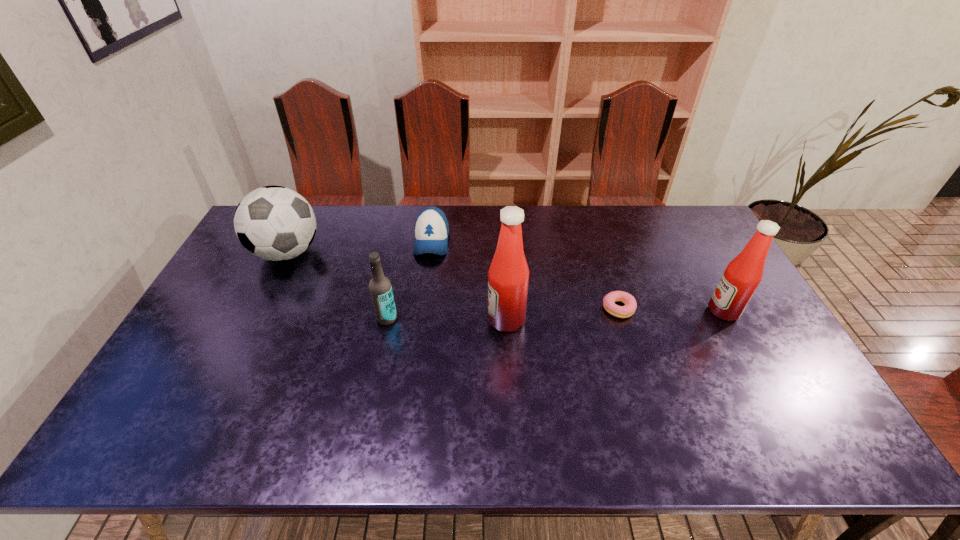
This screenshot has width=960, height=540. Identify the location of baseball cap located in the far edge section of the desktop. (431, 229).

The height and width of the screenshot is (540, 960). In order to click on soccer ball present at the far edge in this screenshot , I will do `click(274, 223)`.

Find the location of a particular element. The width and height of the screenshot is (960, 540). object situated at the left edge is located at coordinates [x=274, y=223].

The height and width of the screenshot is (540, 960). I want to click on object that is positioned at the right edge, so click(742, 276).

Where is `object at the far left corner`? This screenshot has width=960, height=540. object at the far left corner is located at coordinates (274, 223).

Identify the location of vacant region at the far edge. The height and width of the screenshot is (540, 960). (452, 226).

In the image, there is a desktop. At what (x,y) coordinates should I click in order to perform the action: click on vacant space at the near edge. Please return your answer as a coordinate pair (x, y). This screenshot has width=960, height=540. Looking at the image, I should click on (437, 409).

In the image, there is a desktop. Identify the location of vacant space at the left edge. (226, 349).

In the image, there is a desktop. Identify the location of free space at the far right corner. (671, 228).

This screenshot has width=960, height=540. In order to click on vacant space that's between the soccer ball and the taller condiment in this screenshot , I will do `click(396, 286)`.